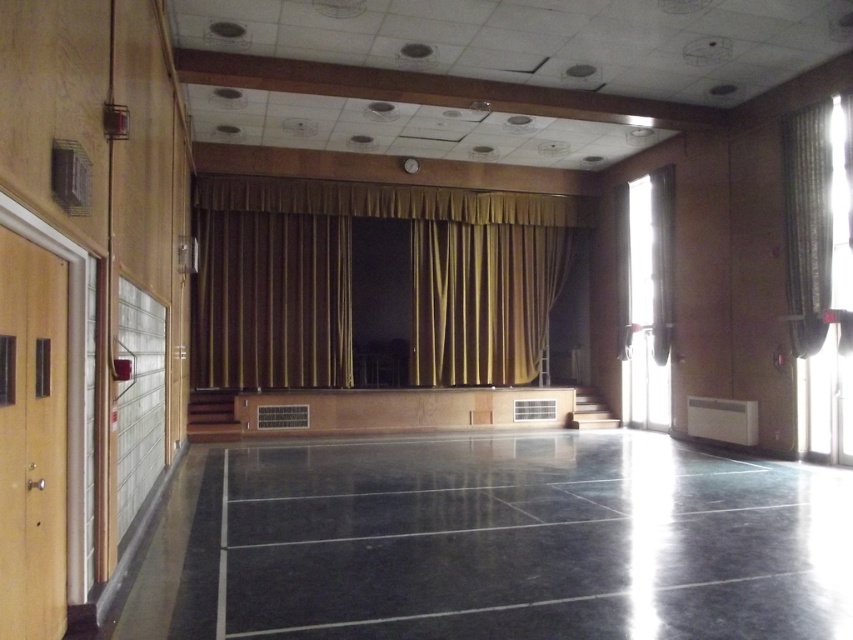
Question: Observing the image, what is the correct spatial positioning of black polished floor at center in reference to gold textured curtain at right?

Choices:
 (A) left
 (B) right

Answer: (A)

Question: Among these points, which one is farthest from the camera?

Choices:
 (A) (827, 518)
 (B) (793, 326)
 (C) (260, 358)

Answer: (C)

Question: Which of these objects is positioned farthest from the black polished floor at center?

Choices:
 (A) gold textured curtain at right
 (B) gold fabric curtain at center

Answer: (B)

Question: Which object is positioned closest to the gold textured curtain at right?

Choices:
 (A) black polished floor at center
 (B) gold fabric curtain at center

Answer: (A)

Question: Is black polished floor at center positioned in front of gold textured curtain at right?

Choices:
 (A) no
 (B) yes

Answer: (B)

Question: Is gold fabric curtain at center positioned before gold textured curtain at right?

Choices:
 (A) yes
 (B) no

Answer: (B)